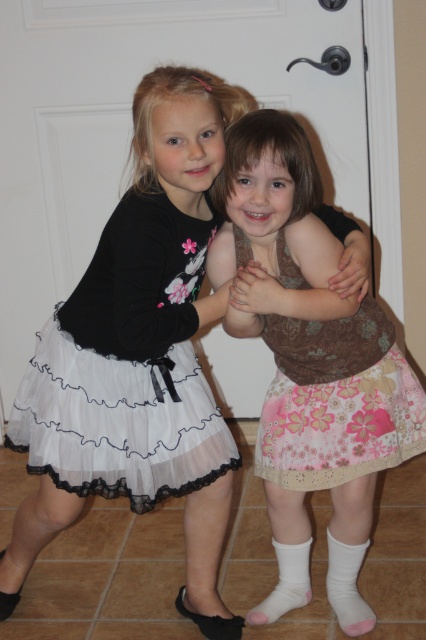
You are a photographer trying to capture the perfect shot of the two girls. You want to focus on the pink floral skirt at center. Where should you aim your camera to ensure the skirt is centered in the frame?

The pink floral skirt at center is located at point coordinates 0.569 on the x axis and 0.725 on the y axis, so you should aim your camera at those coordinates to center the skirt in the frame.

From the picture: What is the position of the point at coordinates (308, 364) in the image?

The point at coordinates (308, 364) is located on the pink floral skirt at center.

You are a fashion designer who wants to place two skirts side by side on a mannequin. The mannequin has a waist width of 14 inches. Given the distance between the white sheer skirt at center and the floral cotton skirt at center, will they fit together on the mannequin?

The white sheer skirt at center and floral cotton skirt at center are 12.89 inches apart, so they can fit together on the mannequin since the distance between them is less than the mannequin waist width of 14 inches.